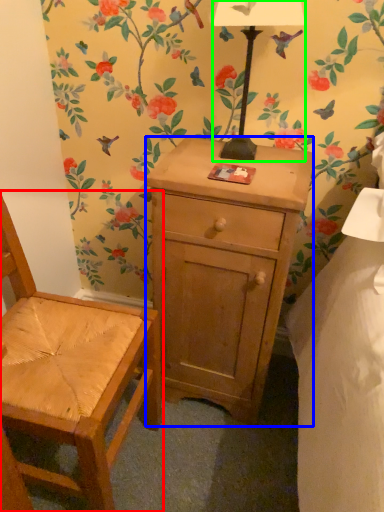
Question: Which object is the closest to the chair (highlighted by a red box)? Choose among these: desk (highlighted by a blue box) or lamp (highlighted by a green box).

Choices:
 (A) desk
 (B) lamp

Answer: (A)